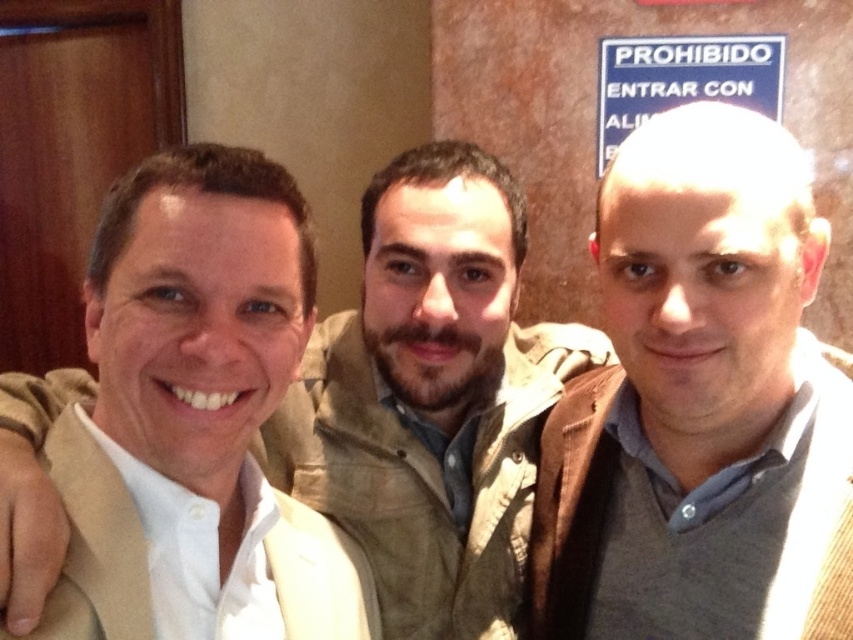
You are a photographer trying to adjust the lighting for a group photo. You notice the gray wool sweater at center and the white shirt at center. Which clothing item should you focus on to ensure proper exposure since it is shorter in height?

The gray wool sweater at center has a lesser height compared to the white shirt at center, so you should focus on the gray wool sweater at center to ensure proper exposure since it is shorter in height.

You are a photographer adjusting the lighting for a group photo. You notice the gray wool sweater at center and the white shirt at center. Which clothing item should you focus the light on to ensure it stands out more, considering their sizes?

The gray wool sweater at center is smaller than the white shirt at center. To ensure it stands out more, focus the light on the gray wool sweater at center since it is smaller and might need more emphasis to be visible.